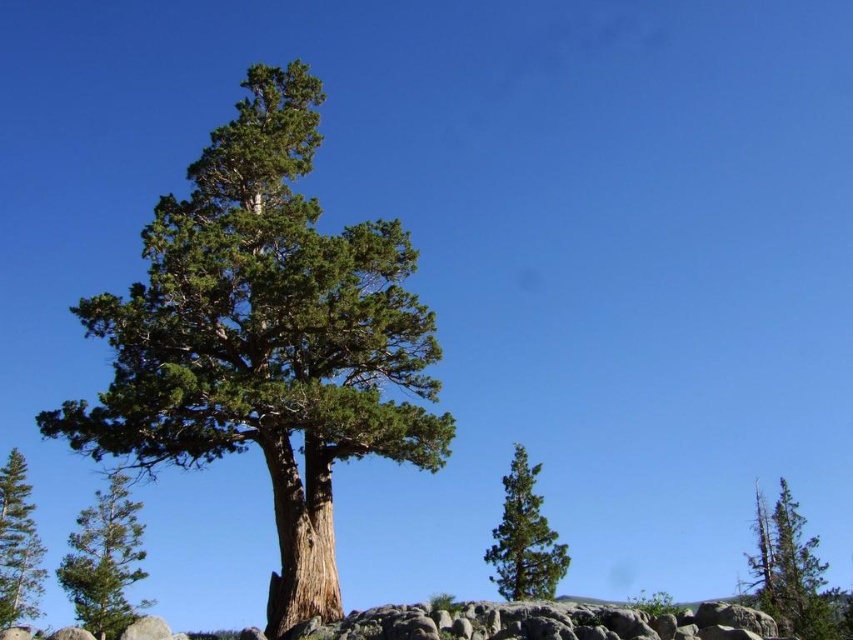
Which is above, green matte tree at lower right or green rough bark tree at left?

green matte tree at lower right

Does green matte tree at lower right have a greater height compared to green rough bark tree at left?

No.

Looking at this image, measure the distance between green matte tree at lower right and camera.

A distance of 37.87 meters exists between green matte tree at lower right and camera.

The image size is (853, 640). What are the coordinates of `green matte tree at lower right` in the screenshot? It's located at (524, 538).

From the picture: Does green rough bark tree at lower left have a greater height compared to green rough bark tree at lower right?

Yes.

Between point (119, 627) and point (838, 612), which one is positioned behind?

The point (838, 612) is more distant.

Is point (136, 577) less distant than point (790, 593)?

No, it is behind (790, 593).

This screenshot has width=853, height=640. I want to click on green rough bark tree at lower left, so (103, 561).

Is green rough bark tree at center to the right of green rough bark tree at lower left from the viewer's perspective?

Correct, you'll find green rough bark tree at center to the right of green rough bark tree at lower left.

Between point (286, 586) and point (97, 502), which one is positioned behind?

The point (97, 502) is behind.

The width and height of the screenshot is (853, 640). In order to click on green rough bark tree at center in this screenshot , I will do tap(265, 337).